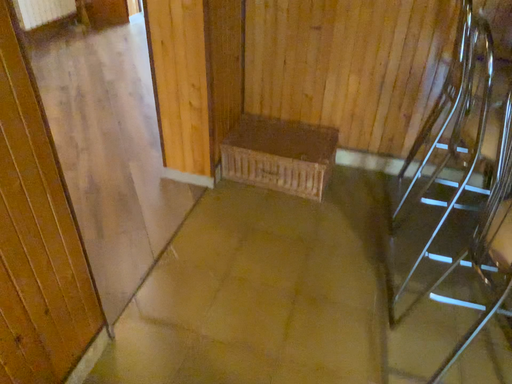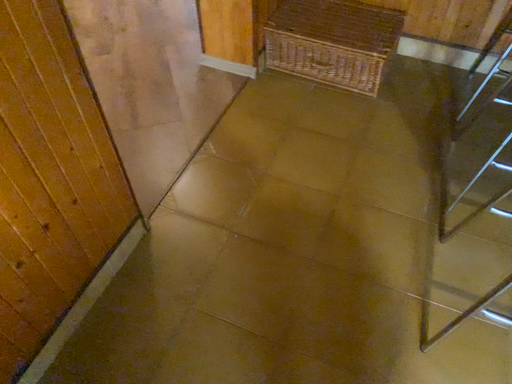
Question: How did the camera likely rotate when shooting the video?

Choices:
 (A) rotated right
 (B) rotated left

Answer: (B)